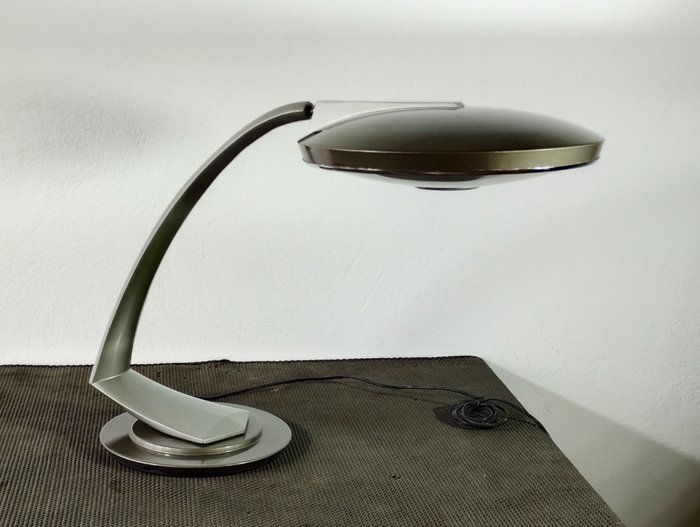
Find the location of a particular element. The width and height of the screenshot is (700, 527). white wall is located at coordinates (138, 85).